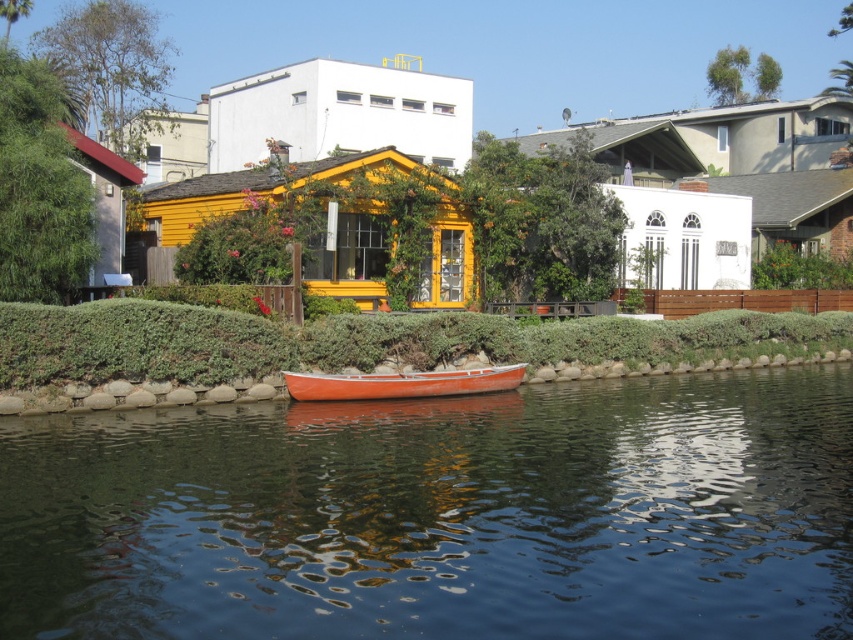
Question: Is glossy orange boat at center above orange wood canoe at center?

Choices:
 (A) no
 (B) yes

Answer: (A)

Question: Does glossy orange boat at center have a smaller size compared to orange wood canoe at center?

Choices:
 (A) yes
 (B) no

Answer: (B)

Question: Among these points, which one is farthest from the camera?

Choices:
 (A) (439, 388)
 (B) (22, 572)

Answer: (A)

Question: Is glossy orange boat at center wider than orange wood canoe at center?

Choices:
 (A) yes
 (B) no

Answer: (A)